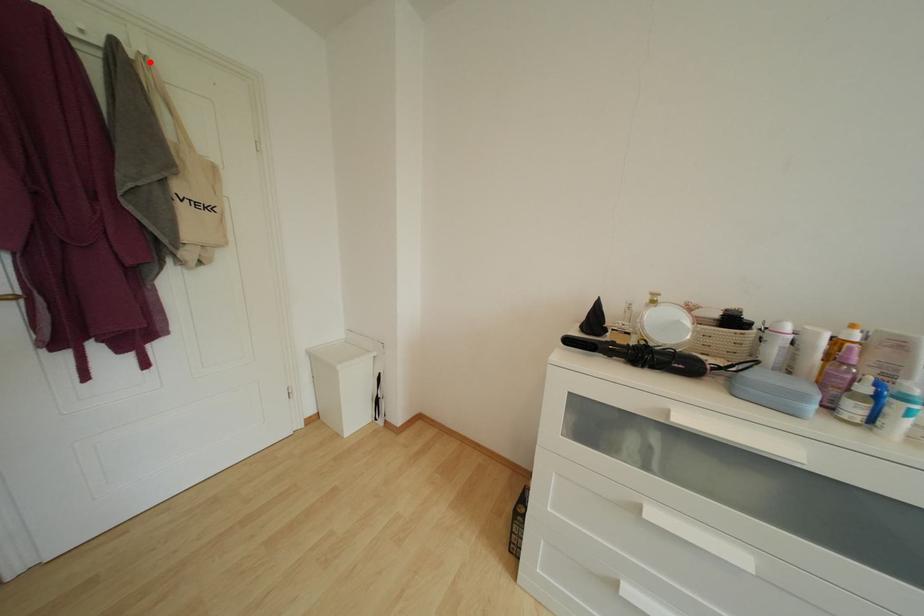
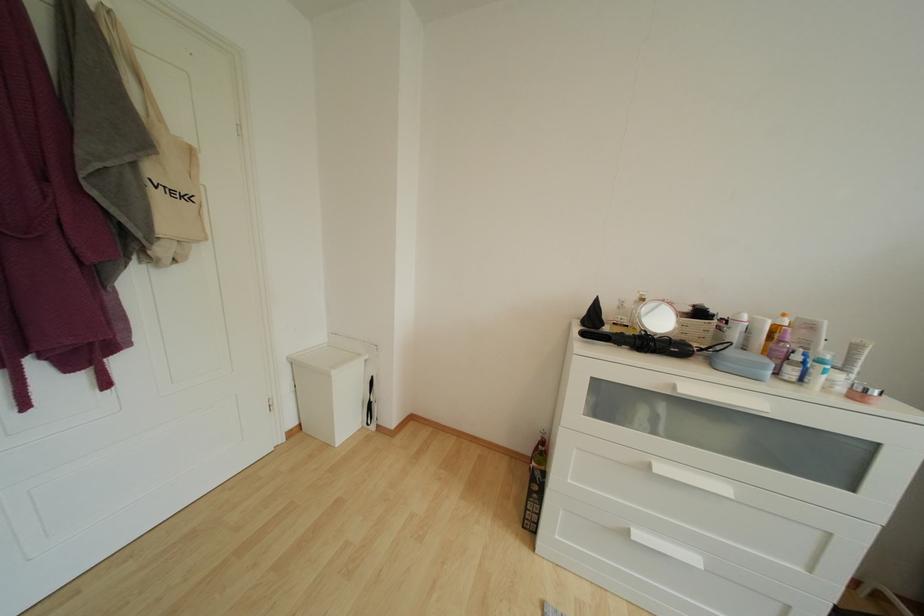
The point at the highlighted location is marked in the first image. Where is the corresponding point in the second image?

(114, 15)